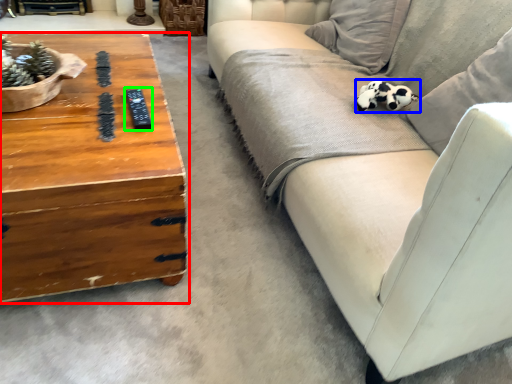
Question: Which object is the closest to the coffee table (highlighted by a red box)? Choose among these: animal (highlighted by a blue box) or remote (highlighted by a green box).

Choices:
 (A) animal
 (B) remote

Answer: (B)